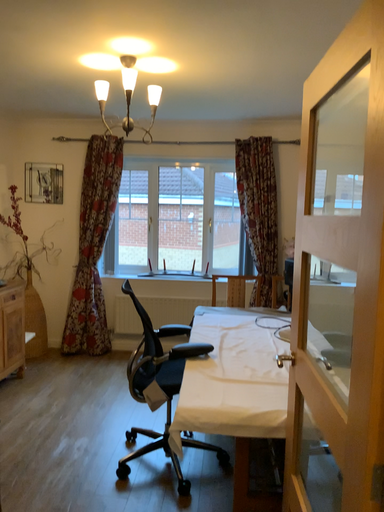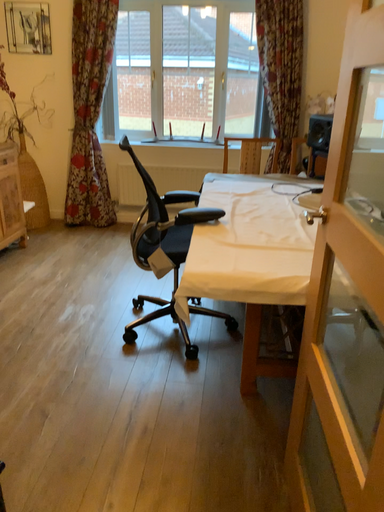
Question: How did the camera likely rotate when shooting the video?

Choices:
 (A) rotated downward
 (B) rotated upward

Answer: (A)